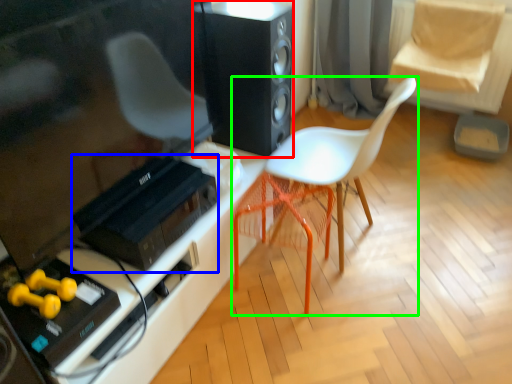
Question: Which is nearer to the loudspeaker (highlighted by a red box)? stereo (highlighted by a blue box) or chair (highlighted by a green box).

Choices:
 (A) stereo
 (B) chair

Answer: (B)